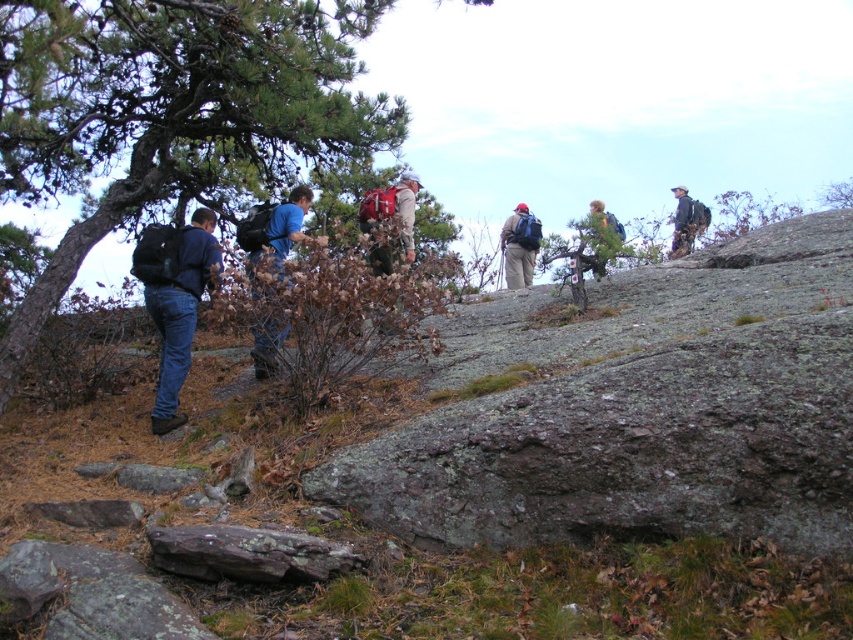
You are a hiker navigating the rocky trail and need to reach a specific location. You see two points marked on your map corresponding to coordinates in the scene. The first point is at point [461,582] and the second is at point [596,268]. If you are standing at the starting point, which point should you head towards first to stay on the most efficient path?

You should head towards point [461,582] first because it is in front of point [596,268], making it the more direct path forward.

You are a hiker carrying the blue fabric backpack at left and need to place it on the brown rough rock at center. Based on the size of the rock and backpack, will the backpack fit securely on the rock?

The brown rough rock at center is smaller than the blue fabric backpack at left, so the backpack will not fit securely on the rock.